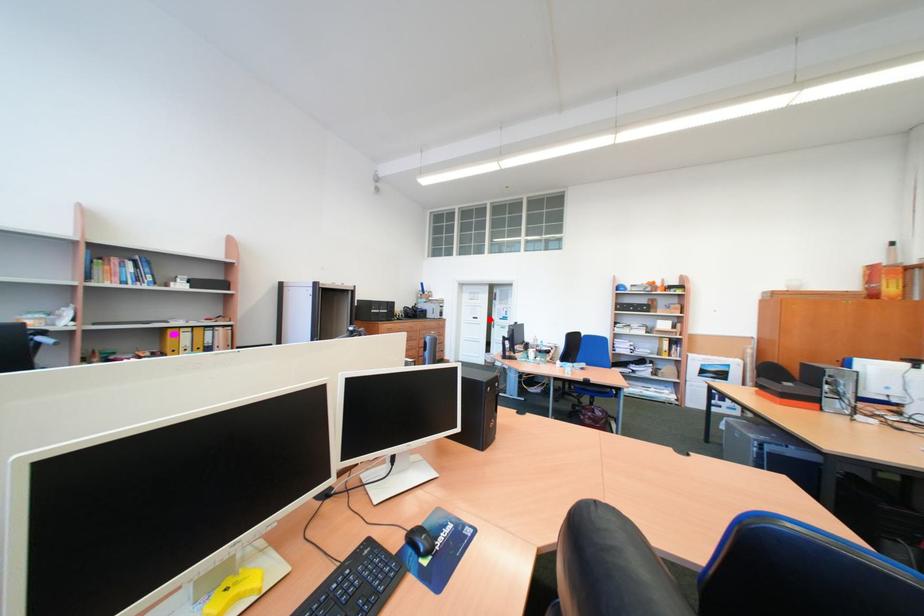
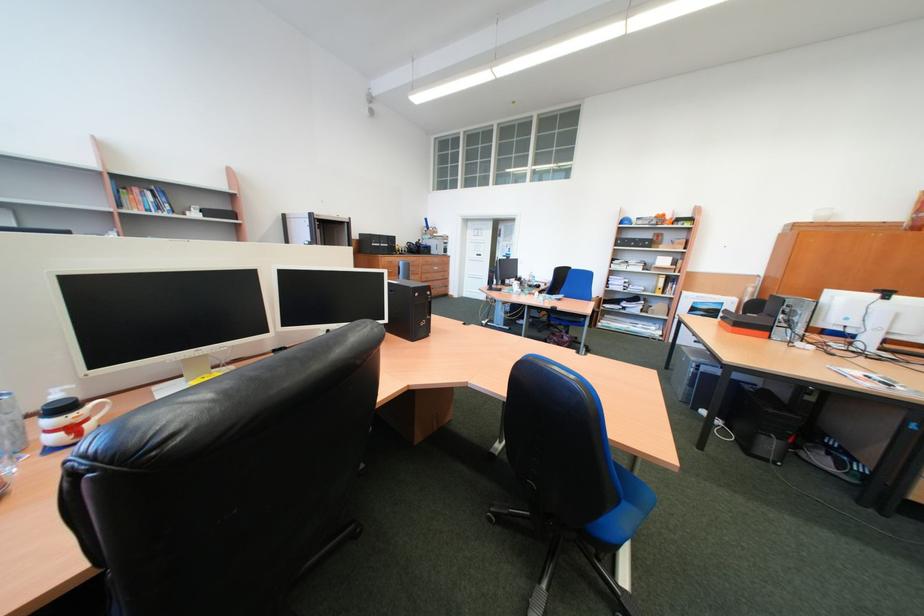
Find the pixel in the second image that matches the highlighted location in the first image.

(493, 257)